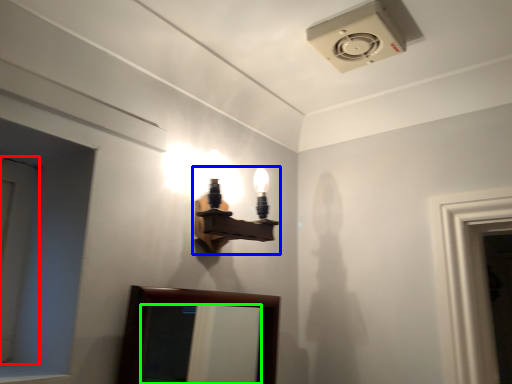
Question: Which object is the closest to the door (highlighted by a red box)? Choose among these: lamp (highlighted by a blue box) or mirror (highlighted by a green box).

Choices:
 (A) lamp
 (B) mirror

Answer: (A)